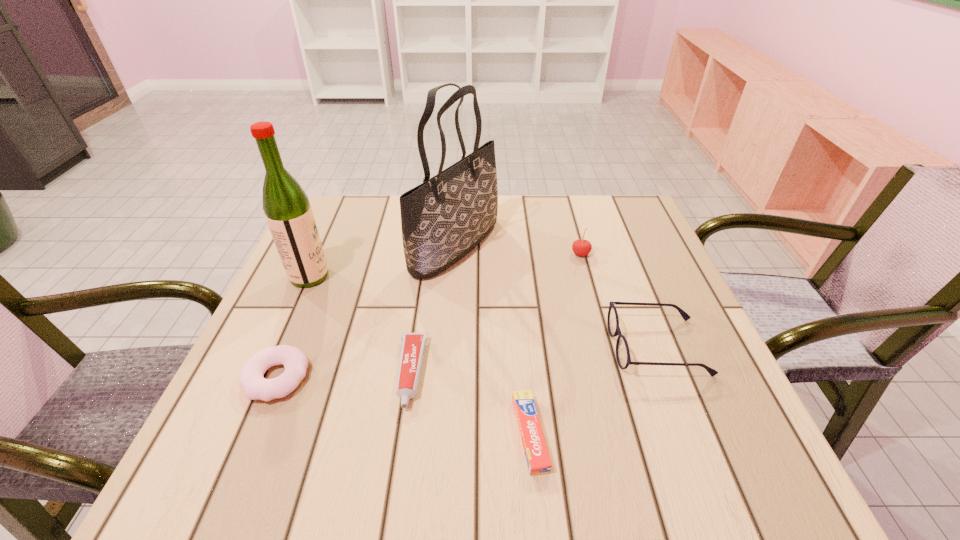
Find the location of `doughnut present at the left edge`. doughnut present at the left edge is located at coordinates (256, 387).

The height and width of the screenshot is (540, 960). Identify the location of object positioned at the right edge. (623, 357).

Identify the location of free space at the far edge of the desktop. The height and width of the screenshot is (540, 960). (557, 231).

Locate an element on the screen. The height and width of the screenshot is (540, 960). vacant space at the near edge of the desktop is located at coordinates (468, 483).

Identify the location of free spot at the left edge of the desktop. The height and width of the screenshot is (540, 960). (325, 321).

Image resolution: width=960 pixels, height=540 pixels. Find the location of `vacant area at the right edge`. vacant area at the right edge is located at coordinates (718, 383).

Locate an element on the screen. The image size is (960, 540). blank space at the far left corner is located at coordinates [x=358, y=207].

This screenshot has width=960, height=540. In the image, there is a desktop. In order to click on vacant region at the far right corner in this screenshot , I will do `click(591, 198)`.

Find the location of a particular element. free region at the near right corner of the desktop is located at coordinates (735, 458).

Locate an element on the screen. empty space between the left toothpaste and the tote bag is located at coordinates (433, 309).